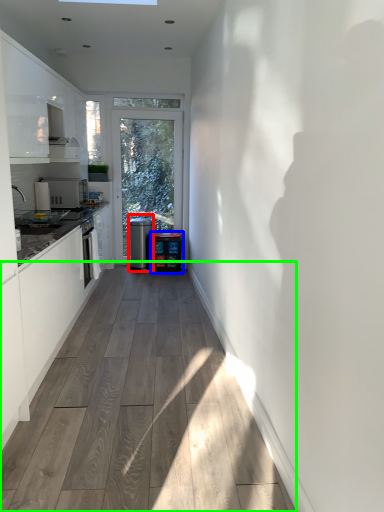
Question: Which is nearer to the water cooler (highlighted by a red box)? water cooler (highlighted by a blue box) or corridor (highlighted by a green box).

Choices:
 (A) water cooler
 (B) corridor

Answer: (A)